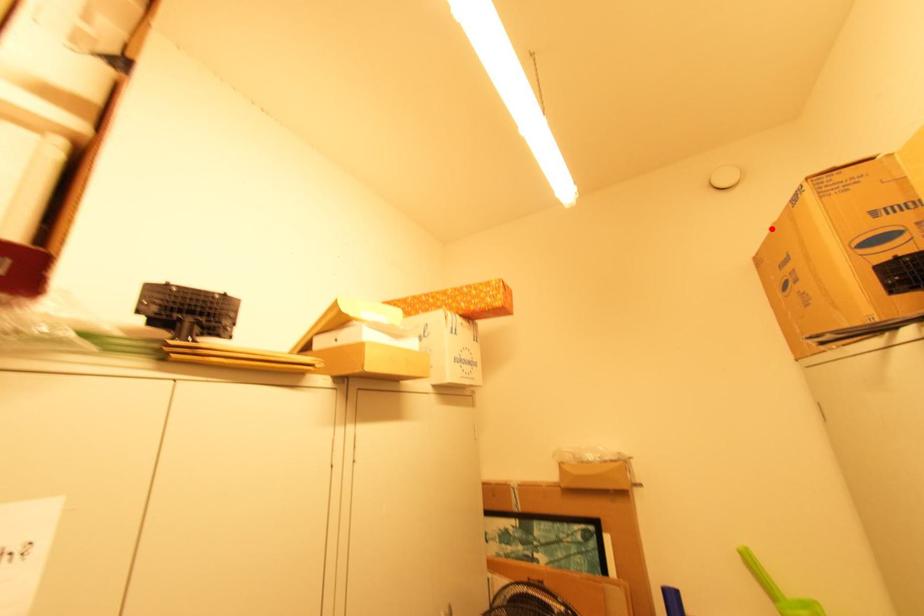
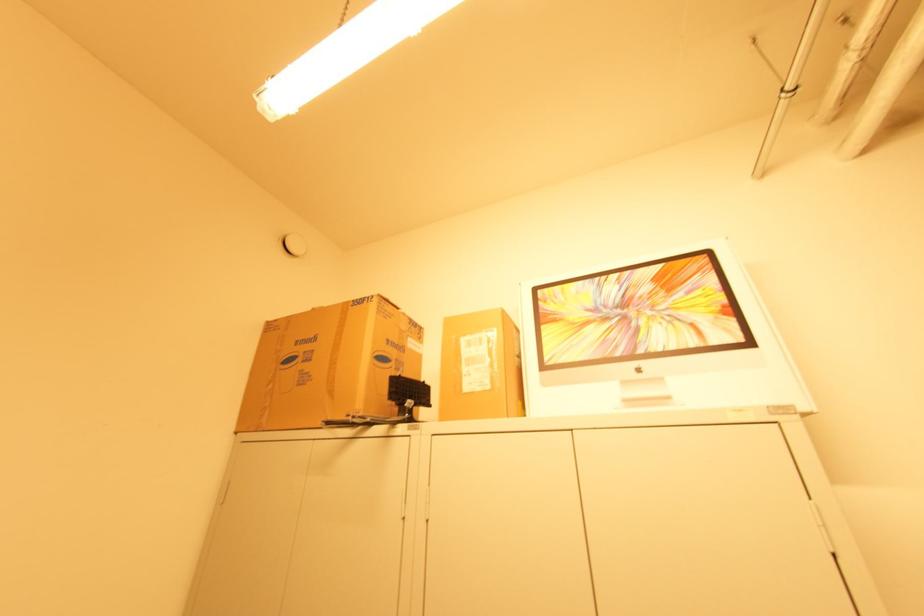
The point at the highlighted location is marked in the first image. Where is the corresponding point in the second image?

(315, 309)